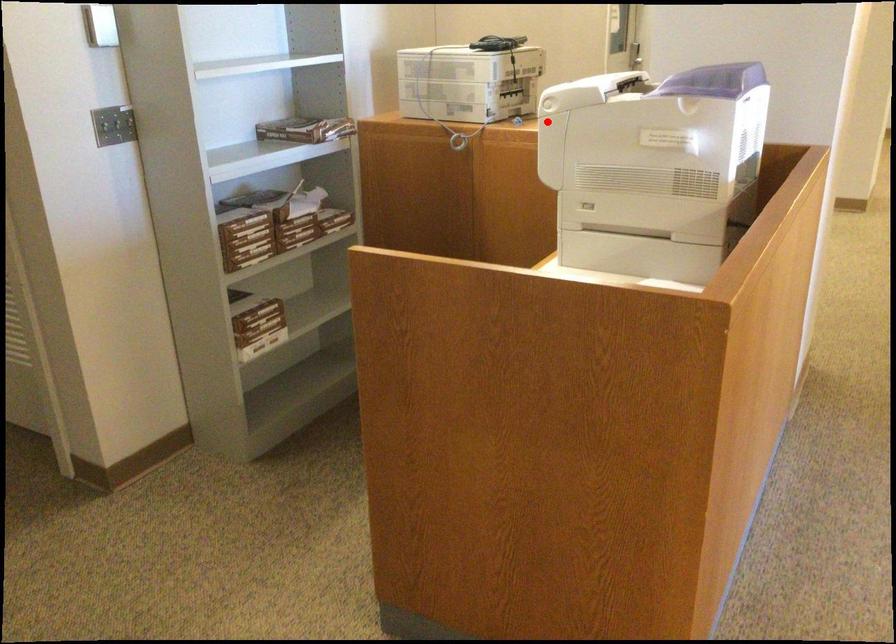
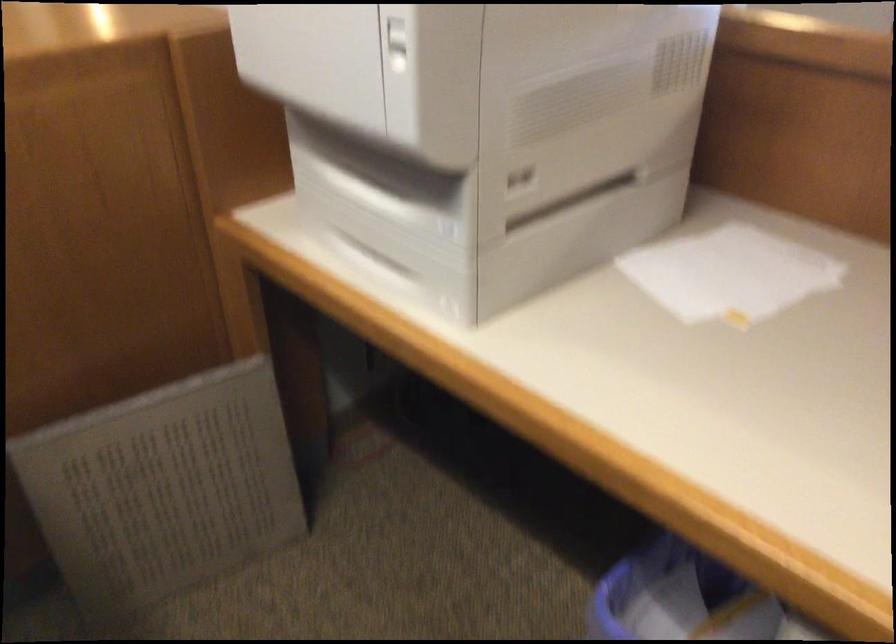
Locate, in the second image, the point that corresponds to the highlighted location in the first image.

(397, 44)